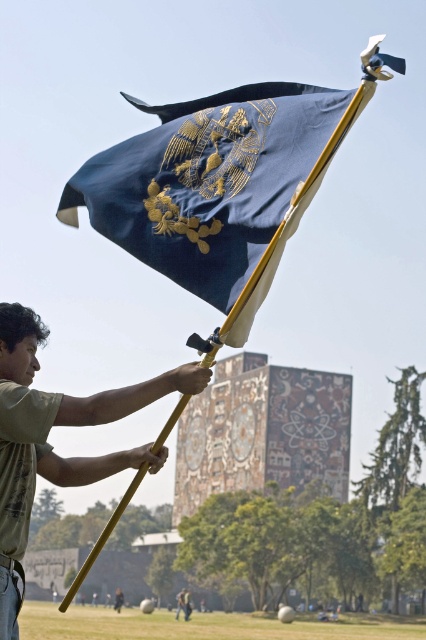
You are standing in the park and see a person holding a flagpole. You notice the blue silk flag at center and the green cotton shirt at center. Which object is positioned to the right of the other?

The blue silk flag at center is to the right of the green cotton shirt at center.

From the picture: You are a photographer trying to capture a clear shot of the blue silk flag at center without any obstructions. Based on the scene, is the green cotton shirt at center blocking your view of the flag?

The blue silk flag at center is in front of the green cotton shirt at center, so the flag is not obstructed by the shirt and can be captured clearly.

You are a photographer trying to capture the flagpole and the person in the scene. Since the blue silk flag at center and the green cotton shirt at center are both in the frame, can you determine which one is shorter in height?

The blue silk flag at center has a lesser height compared to the green cotton shirt at center, so the flag is shorter than the shirt.